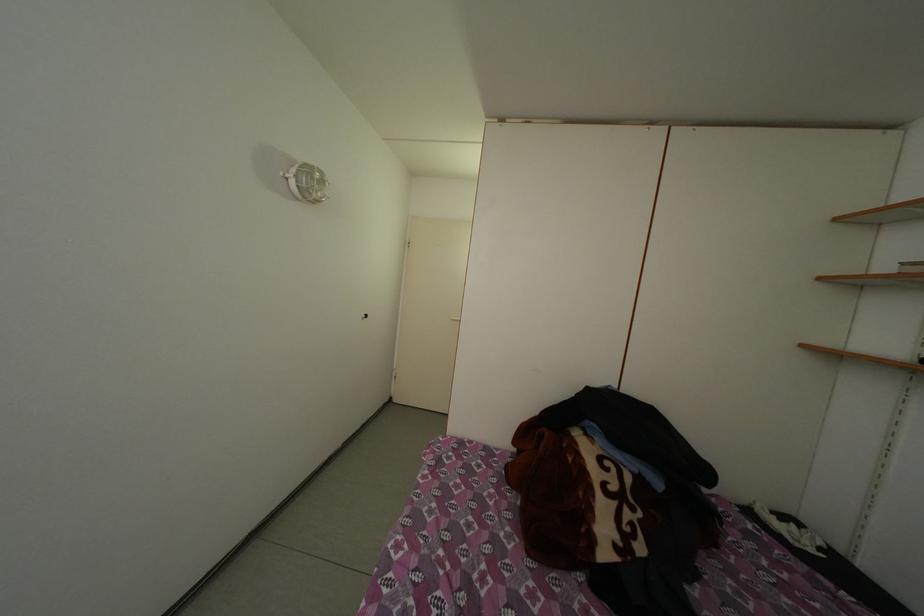
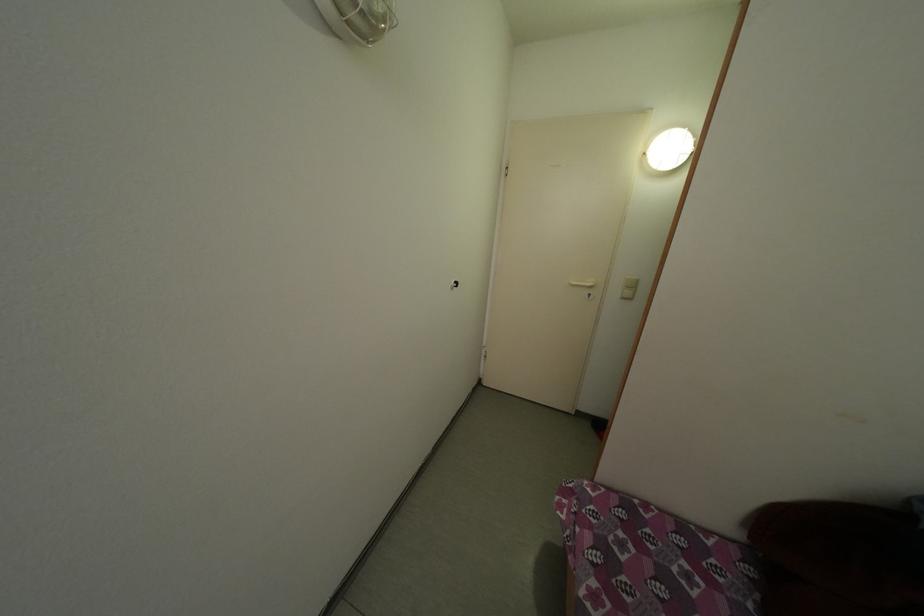
Based on the photo, which direction would the cameraman need to move to produce the second image?

The cameraman moved toward left, forward.